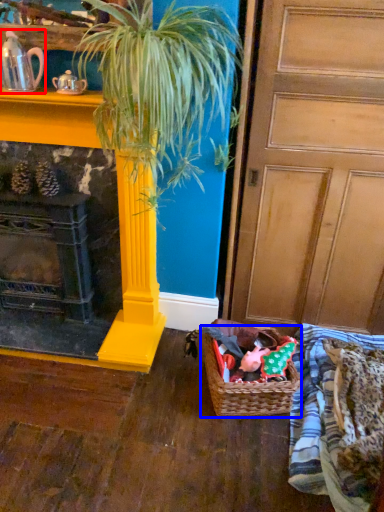
Question: Among these objects, which one is farthest to the camera, tea pot (highlighted by a red box) or basket (highlighted by a blue box)?

Choices:
 (A) tea pot
 (B) basket

Answer: (B)